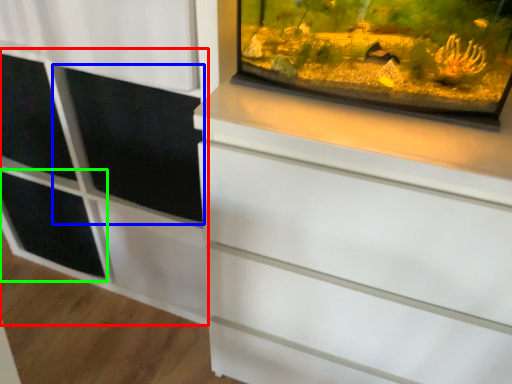
Question: Which object is the farthest from side cabinet (highlighted by a red box)? Choose among these: screen door (highlighted by a blue box) or shelf (highlighted by a green box).

Choices:
 (A) screen door
 (B) shelf

Answer: (B)